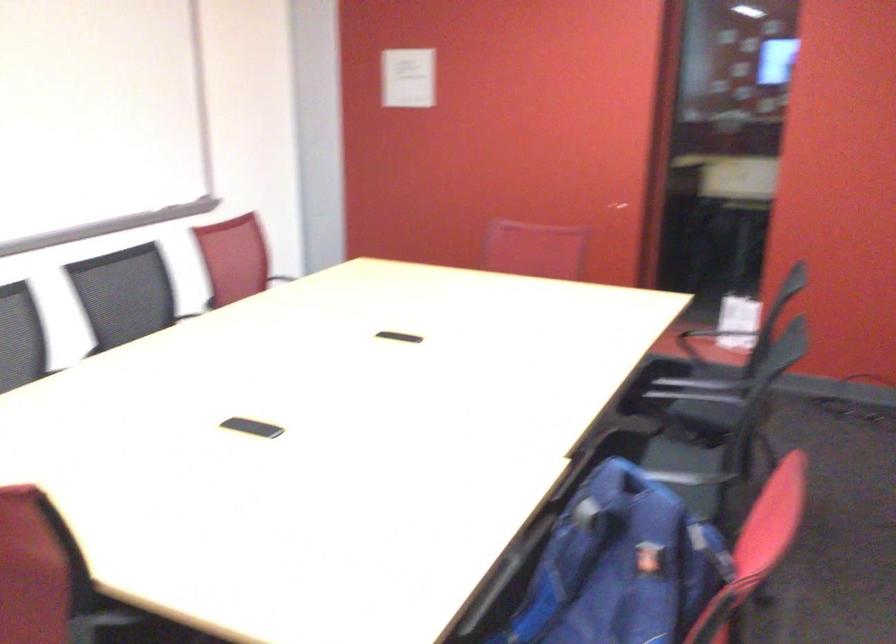
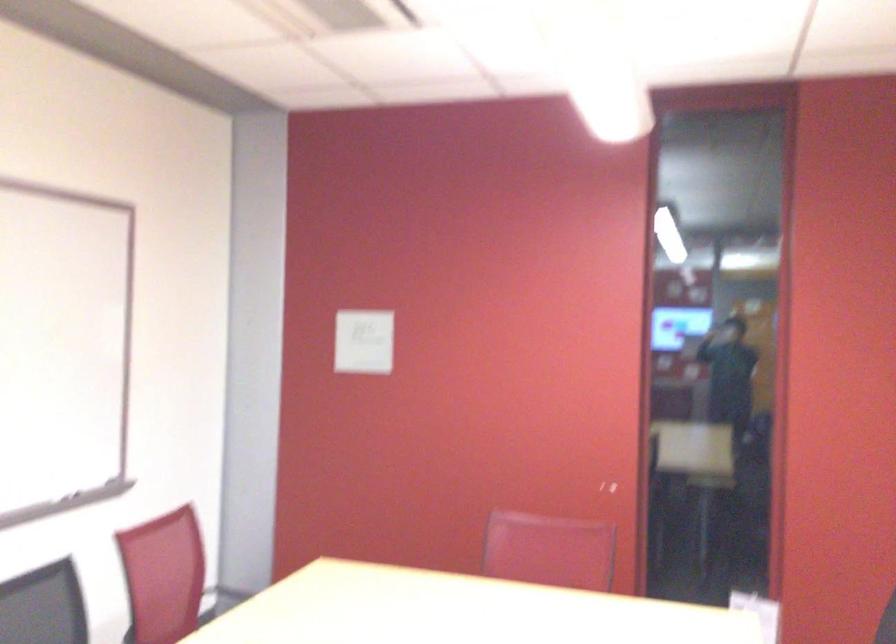
The images are taken continuously from a first-person perspective. In which direction are you moving?

The cameraman moved toward left, forward.